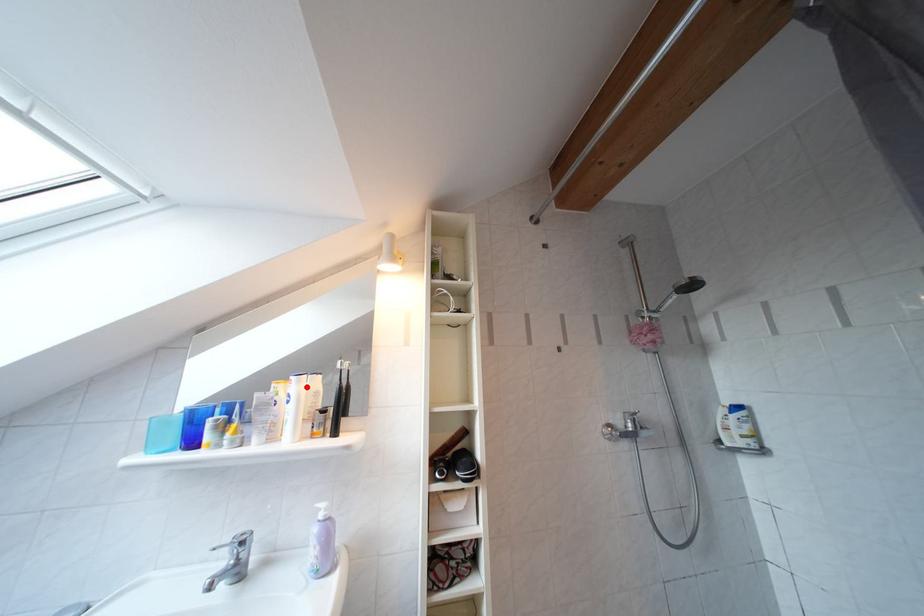
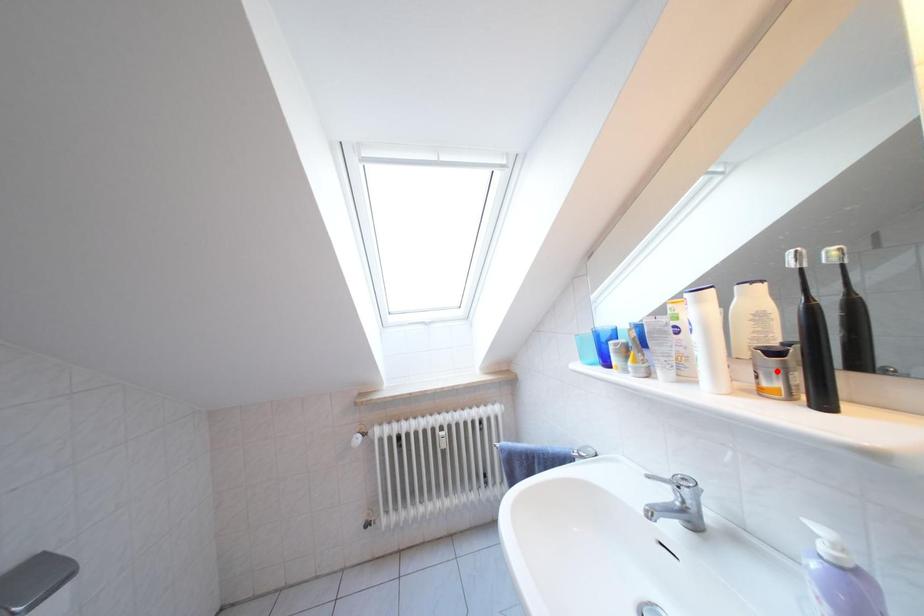
I am providing you with two images of the same scene from different viewpoints. A red point is marked on the first image and another point is marked on the second image. Is the red point in image1 aligned with the point shown in image2?

No